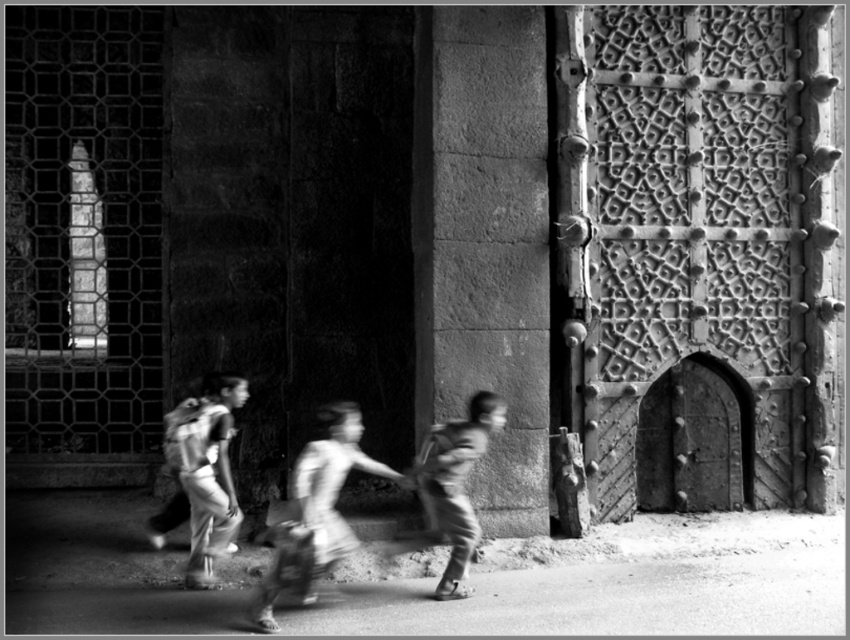
Measure the distance between rough stone pillar at center and camera.

The distance of rough stone pillar at center from camera is 6.94 meters.

Who is taller, rough stone pillar at center or matte backpack at center?

rough stone pillar at center

Is point (491, 221) positioned before point (238, 506)?

No, it is behind (238, 506).

Where is `rough stone pillar at center`? Image resolution: width=850 pixels, height=640 pixels. rough stone pillar at center is located at coordinates (483, 241).

Can you confirm if smooth fabric bag at center is shorter than matte backpack at center?

Yes, smooth fabric bag at center is shorter than matte backpack at center.

Is smooth fabric bag at center to the left of matte backpack at center from the viewer's perspective?

No, smooth fabric bag at center is not to the left of matte backpack at center.

Does point (264, 589) come farther from viewer compared to point (180, 429)?

No, (264, 589) is closer to viewer.

Find the location of a particular element. The height and width of the screenshot is (640, 850). smooth fabric bag at center is located at coordinates (318, 509).

Is matte backpack at center in front of smooth skin boy at center?

That is False.

Can you confirm if matte backpack at center is smaller than smooth skin boy at center?

Yes.

Between point (219, 435) and point (493, 410), which one is positioned behind?

Point (219, 435)

Where is `matte backpack at center`? The width and height of the screenshot is (850, 640). matte backpack at center is located at coordinates (207, 468).